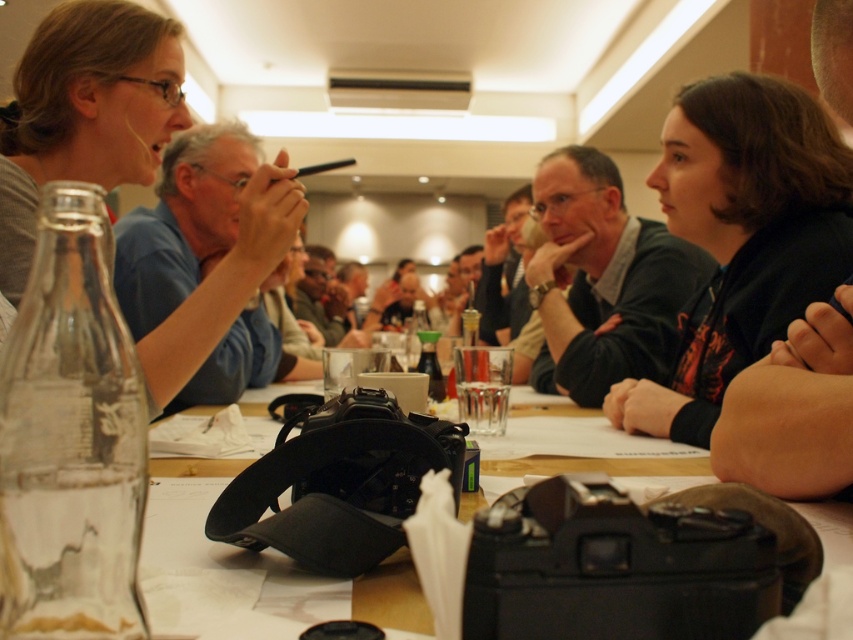
Question: Which point is closer to the camera?

Choices:
 (A) clear glass bottle at lower left
 (B) translucent glass bottle at center
 (C) black matte jacket at right

Answer: (A)

Question: Can you confirm if clear glass bottle at lower left is thinner than black matte jacket at right?

Choices:
 (A) no
 (B) yes

Answer: (B)

Question: Does clear glass bottle at lower left come behind matte gray shirt at upper left?

Choices:
 (A) yes
 (B) no

Answer: (B)

Question: Which is farther from the black matte jacket at right?

Choices:
 (A) matte gray shirt at upper left
 (B) clear glass bottle at lower left
 (C) black plastic camera at center
 (D) translucent glass bottle at center

Answer: (B)

Question: Which of these objects is positioned closest to the clear glass bottle at lower left?

Choices:
 (A) matte gray shirt at upper left
 (B) translucent glass bottle at center
 (C) black matte jacket at right

Answer: (B)

Question: Considering the relative positions of clear glass bottle at lower left and black plastic camera at center in the image provided, where is clear glass bottle at lower left located with respect to black plastic camera at center?

Choices:
 (A) below
 (B) above

Answer: (B)